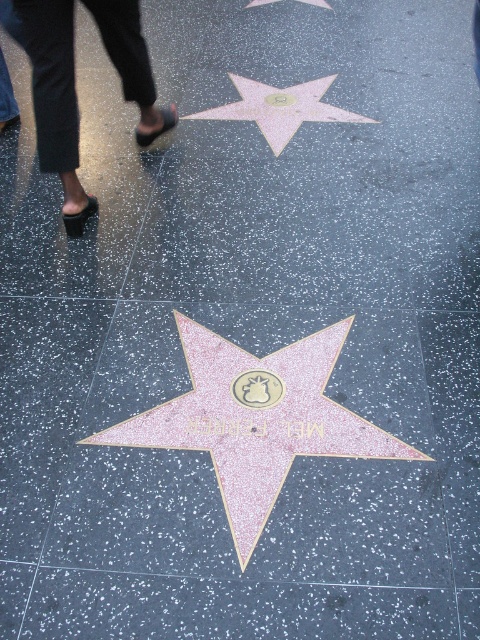
You are standing on the Hollywood Walk of Fame and see the black leather sandals at upper left and the pink glittery star at center. Which object is nearer to you?

The black leather sandals at upper left is closer to the viewer than the pink glittery star at center.

You are a tourist standing at the Hollywood Walk of Fame. You see the black leather sandals at upper left and the pink glittery star at upper center. If you want to touch both items, which one would you need to reach further for?

The black leather sandals at upper left are 27.04 inches away from the pink glittery star at upper center. Since the question asks which requires reaching further, but the distance between them is given, but the question is about which is farther from the tourist. However, the description only provides the distance between the two objects, not their individual distances from the tourist. Therefore, without knowing each object